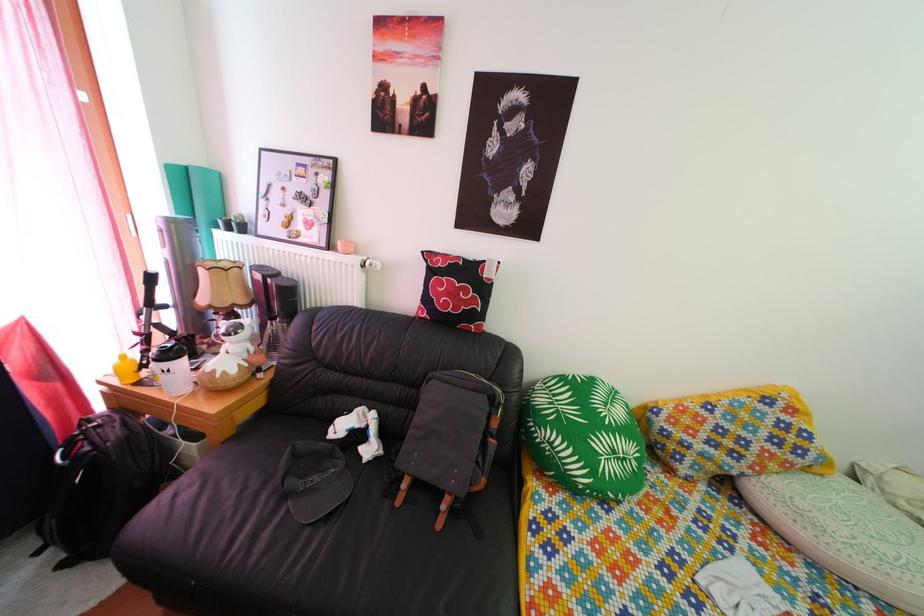
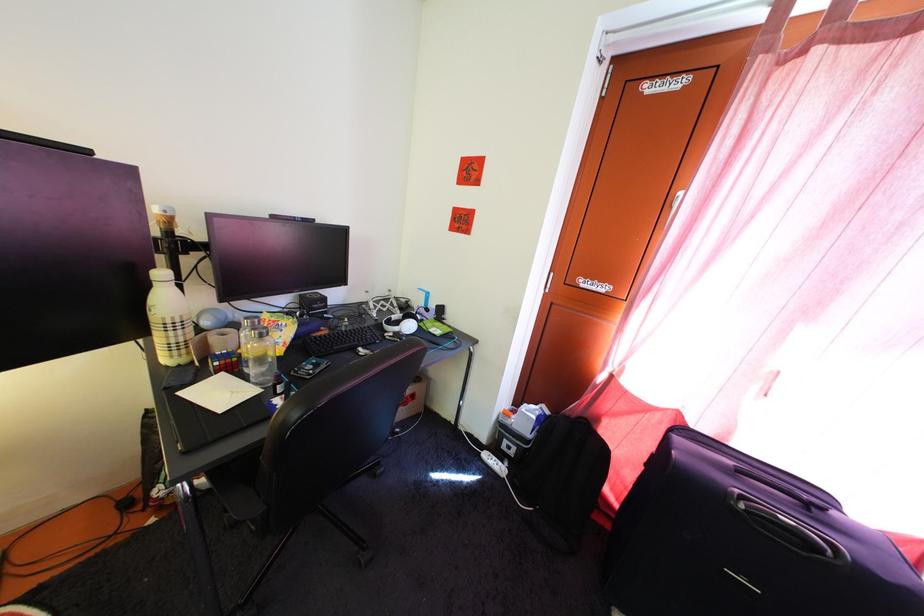
Based on the continuous images, in which direction is the camera rotating?

The camera rotated toward left-down.